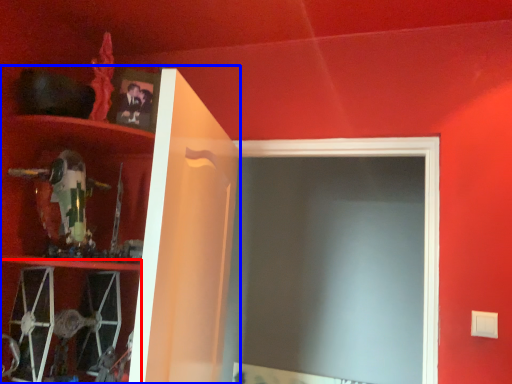
Question: Which of the following is the farthest to the observer, cabinet (highlighted by a red box) or cabinet (highlighted by a blue box)?

Choices:
 (A) cabinet
 (B) cabinet

Answer: (A)